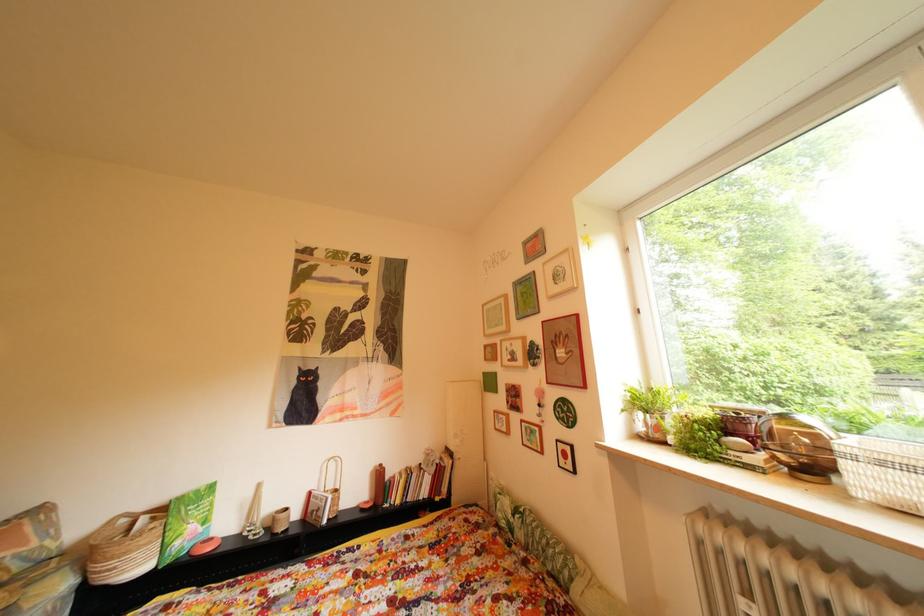
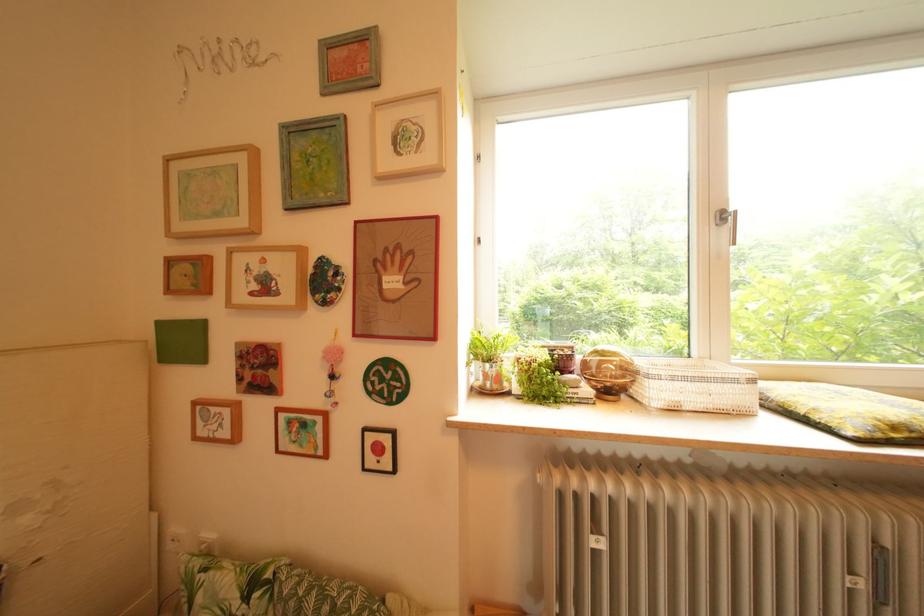
Question: The first image is from the beginning of the video and the second image is from the end. How did the camera likely rotate when shooting the video?

Choices:
 (A) Left
 (B) Right
 (C) Up
 (D) Down

Answer: (B)